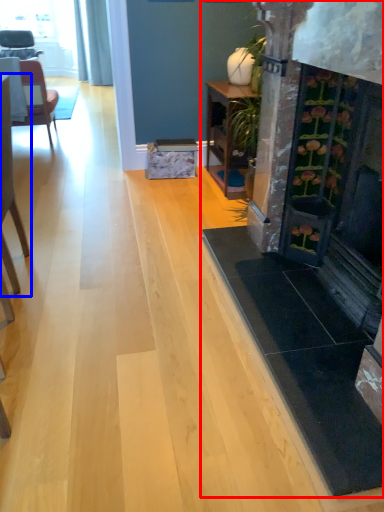
Question: Which point is further to the camera, fireplace (highlighted by a red box) or chair (highlighted by a blue box)?

Choices:
 (A) fireplace
 (B) chair

Answer: (B)